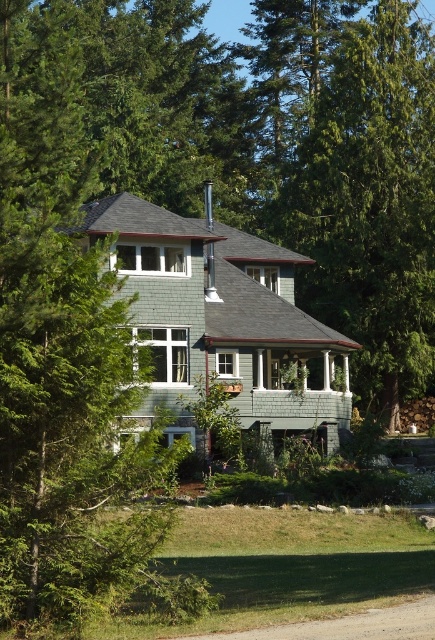
You are standing in front of the two story house and want to determine which of the two points, point (80,228) or point (348,99), is closer to you. Based on the house structure and the surrounding forest, which point is nearer?

Point (80,228) is closer to the viewer than point (348,99).

You are standing in front of the two green trees near the house. The green leafy tree at left and the green textured tree at center are both in your view. Which tree would cast a bigger shadow on the ground?

The green leafy tree at left has a larger size compared to the green textured tree at center, so it would cast a bigger shadow on the ground.